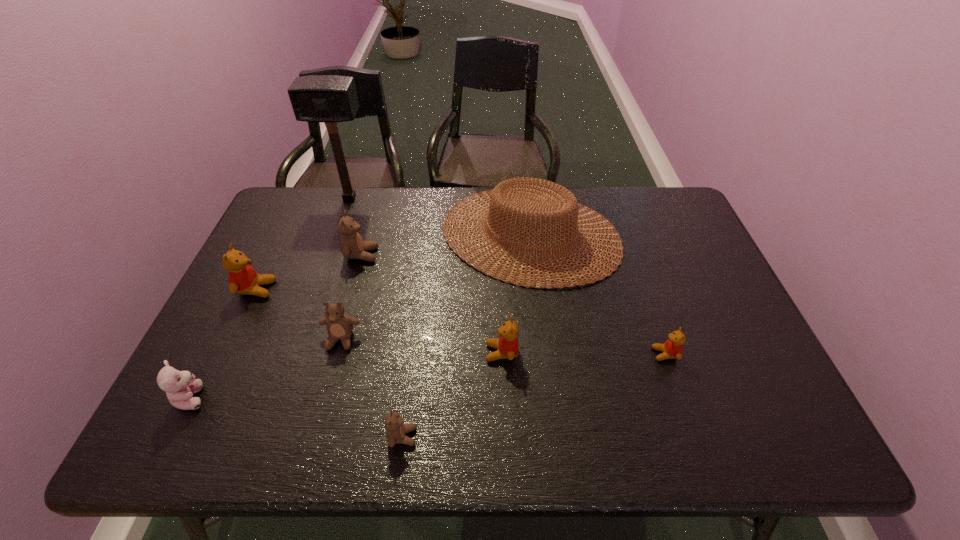
This screenshot has width=960, height=540. I want to click on pink teddy bear, so click(180, 386).

You are a GUI agent. You are given a task and a screenshot of the screen. Output one action in this format:
    pyautogui.click(x=<x>, y=<y>)
    Task: Click on the smallest red teddy bear
    
    Given the screenshot: What is the action you would take?
    pyautogui.click(x=672, y=348)

Identify the location of the rightmost teddy bear. This screenshot has width=960, height=540. (672, 348).

You are a GUI agent. You are given a task and a screenshot of the screen. Output one action in this format:
    pyautogui.click(x=<x>, y=<y>)
    Task: Click on the nearest teddy bear
    The image size is (960, 540).
    Given the screenshot: What is the action you would take?
    coord(396,430)

The image size is (960, 540). I want to click on the fifth teddy bear from left to right, so click(x=396, y=430).

The image size is (960, 540). Identify the location of free space located on the front of the mallet. (323, 277).

Locate an element on the screen. The image size is (960, 540). vacant space located on the front of the beige sunhat is located at coordinates (540, 315).

Image resolution: width=960 pixels, height=540 pixels. What are the coordinates of `vacant space located on the front-facing side of the farthest teddy bear` in the screenshot? It's located at (434, 255).

Locate an element on the screen. Image resolution: width=960 pixels, height=540 pixels. vacant space located on the front-facing side of the farthest red teddy bear is located at coordinates (299, 289).

Image resolution: width=960 pixels, height=540 pixels. Find the location of `free region located on the front-facing side of the sixth teddy bear from left to right`. free region located on the front-facing side of the sixth teddy bear from left to right is located at coordinates (380, 353).